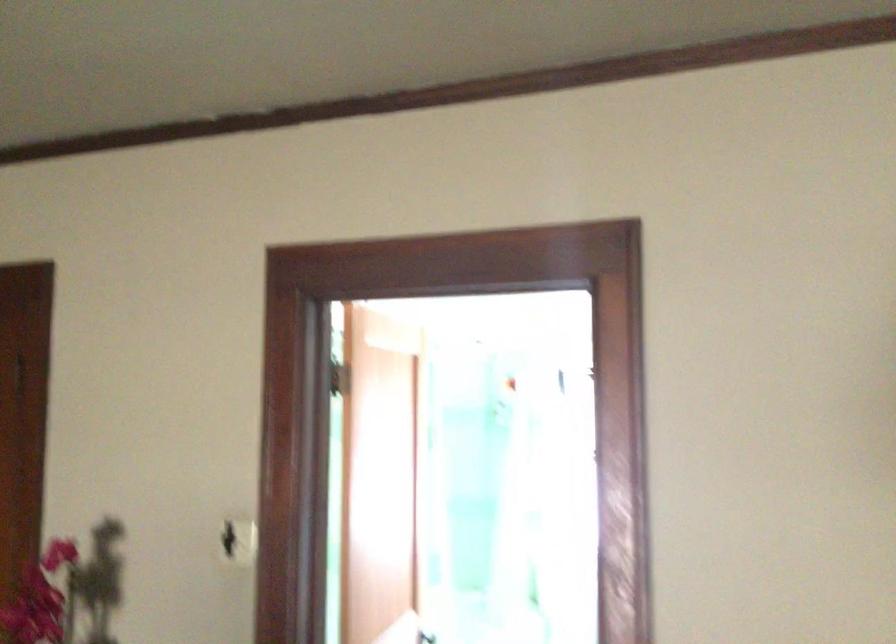
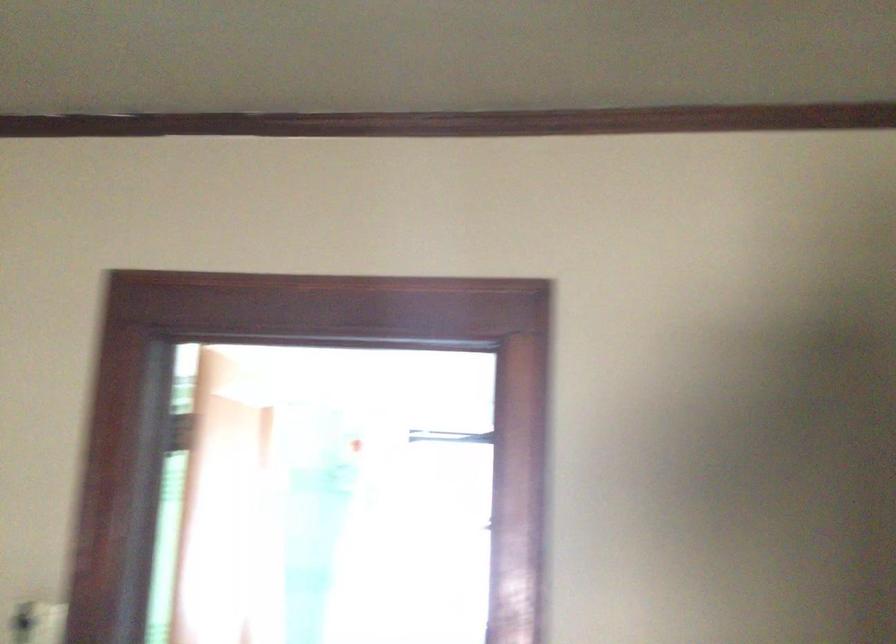
Question: How did the camera likely rotate?

Choices:
 (A) Left
 (B) Right
 (C) Up
 (D) Down

Answer: (B)